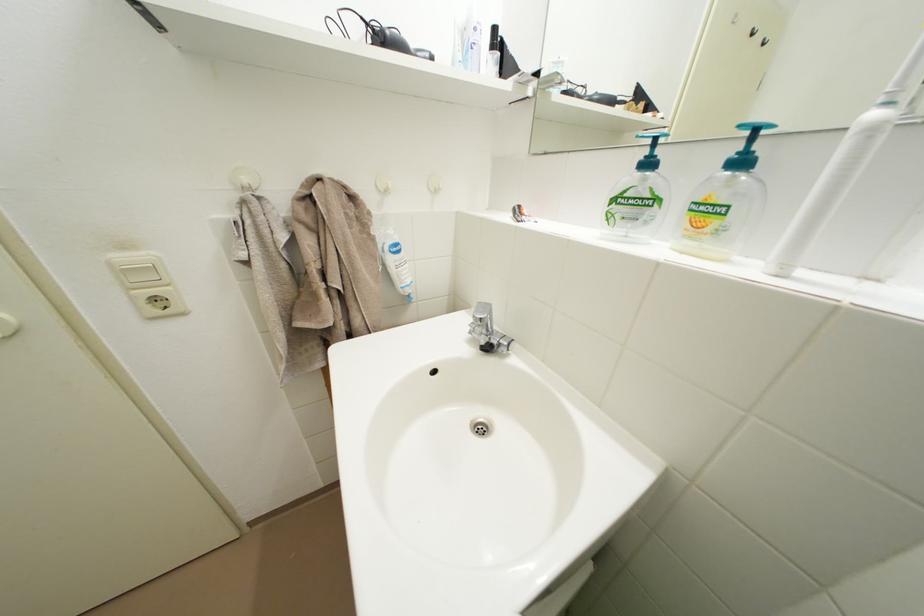
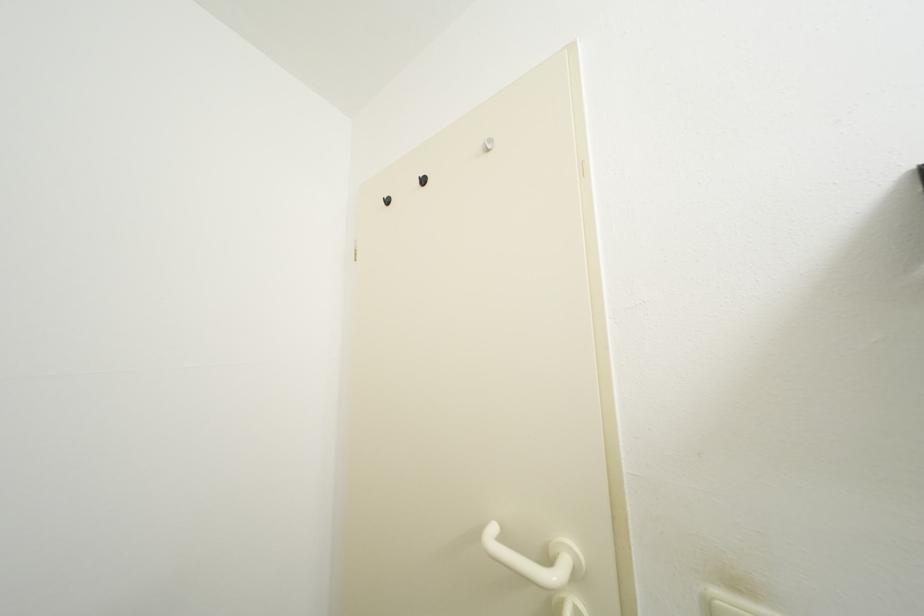
The images are taken continuously from a first-person perspective. In which direction is your viewpoint rotating?

The camera's rotation is toward left-up.